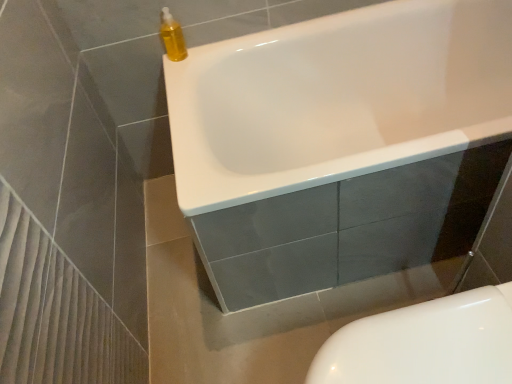
This screenshot has height=384, width=512. Identify the location of empty space that is ontop of white glossy toilet at lower right. (419, 339).